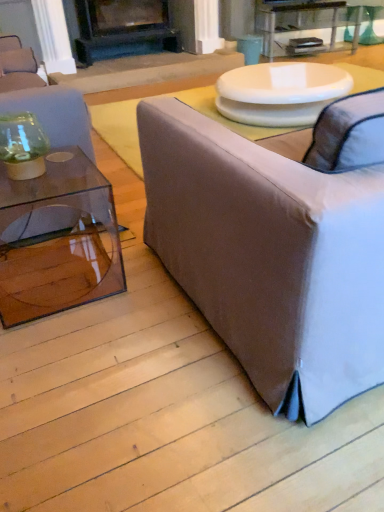
Question: Would you say white glossy table at upper center is part of black matte fireplace at upper center's contents?

Choices:
 (A) no
 (B) yes

Answer: (A)

Question: Is black matte fireplace at upper center taller than white glossy table at upper center?

Choices:
 (A) yes
 (B) no

Answer: (A)

Question: Is black matte fireplace at upper center to the left of white glossy table at upper center from the viewer's perspective?

Choices:
 (A) yes
 (B) no

Answer: (A)

Question: Is black matte fireplace at upper center facing away from white glossy table at upper center?

Choices:
 (A) no
 (B) yes

Answer: (A)

Question: From a real-world perspective, is black matte fireplace at upper center located beneath white glossy table at upper center?

Choices:
 (A) yes
 (B) no

Answer: (B)

Question: From a real-world perspective, is transparent glass vase at left, which ranks as the 2th studio couch in right-to-left order, above or below light gray fabric couch at right, the second studio couch in the left-to-right sequence?

Choices:
 (A) below
 (B) above

Answer: (B)

Question: From the image's perspective, is transparent glass vase at left, positioned as the 1th studio couch in left-to-right order, above or below light gray fabric couch at right, acting as the 1th studio couch starting from the right?

Choices:
 (A) above
 (B) below

Answer: (A)

Question: Considering the positions of transparent glass vase at left, positioned as the 1th studio couch in left-to-right order, and light gray fabric couch at right, acting as the 1th studio couch starting from the right, in the image, is transparent glass vase at left, positioned as the 1th studio couch in left-to-right order, wider or thinner than light gray fabric couch at right, acting as the 1th studio couch starting from the right,?

Choices:
 (A) wide
 (B) thin

Answer: (B)

Question: Which is correct: transparent glass vase at left, positioned as the 1th studio couch in left-to-right order, is inside light gray fabric couch at right, the second studio couch in the left-to-right sequence, or outside of it?

Choices:
 (A) outside
 (B) inside

Answer: (A)

Question: Is white glossy table at upper center in front of or behind clear glass table at upper center in the image?

Choices:
 (A) behind
 (B) front

Answer: (B)

Question: From the image's perspective, is white glossy table at upper center above or below clear glass table at upper center?

Choices:
 (A) above
 (B) below

Answer: (B)

Question: From a real-world perspective, relative to clear glass table at upper center, is white glossy table at upper center vertically above or below?

Choices:
 (A) above
 (B) below

Answer: (B)

Question: Choose the correct answer: Is white glossy table at upper center inside clear glass table at upper center or outside it?

Choices:
 (A) outside
 (B) inside

Answer: (A)

Question: Considering the positions of clear glass table at upper center and black matte fireplace at upper center in the image, is clear glass table at upper center taller or shorter than black matte fireplace at upper center?

Choices:
 (A) short
 (B) tall

Answer: (A)

Question: In the image, is clear glass table at upper center on the left side or the right side of black matte fireplace at upper center?

Choices:
 (A) right
 (B) left

Answer: (A)